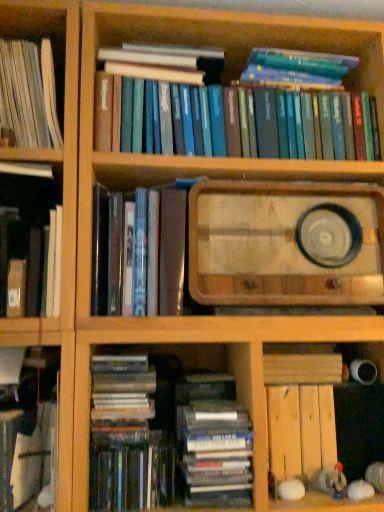
Question: Can you see white paper book at left, which is the eighth book from bottom to top, touching hardcover book at left, the 5th book from the bottom?

Choices:
 (A) yes
 (B) no

Answer: (B)

Question: From a real-world perspective, is white paper book at left, which ranks as the first book in top-to-bottom order, positioned over hardcover book at left, arranged as the 4th book when viewed from the top, based on gravity?

Choices:
 (A) yes
 (B) no

Answer: (A)

Question: From a real-world perspective, does white paper book at left, which is the eighth book from bottom to top, sit lower than hardcover book at left, arranged as the 4th book when viewed from the top?

Choices:
 (A) yes
 (B) no

Answer: (B)

Question: Is white paper book at left, which is the eighth book from bottom to top, completely or partially outside of hardcover book at left, the 5th book from the bottom?

Choices:
 (A) yes
 (B) no

Answer: (A)

Question: Can you confirm if white paper book at left, which ranks as the first book in top-to-bottom order, is shorter than hardcover book at left, arranged as the 4th book when viewed from the top?

Choices:
 (A) yes
 (B) no

Answer: (B)

Question: Is white paper book at left, which is the eighth book from bottom to top, to the left or to the right of wooden radio at center in the image?

Choices:
 (A) left
 (B) right

Answer: (A)

Question: Looking at the image, does white paper book at left, which is the eighth book from bottom to top, seem bigger or smaller compared to wooden radio at center?

Choices:
 (A) big
 (B) small

Answer: (B)

Question: From the image's perspective, is white paper book at left, which is the eighth book from bottom to top, located above or below wooden radio at center?

Choices:
 (A) above
 (B) below

Answer: (A)

Question: Is white paper book at left, which is the eighth book from bottom to top, in front of or behind wooden radio at center in the image?

Choices:
 (A) front
 (B) behind

Answer: (B)

Question: From their relative heights in the image, would you say hardcover books at upper center, positioned as the 2th book in top-to-bottom order, is taller or shorter than matte black book at center, arranged as the sixth book when ordered from the bottom?

Choices:
 (A) tall
 (B) short

Answer: (B)

Question: Is hardcover books at upper center, positioned as the 2th book in top-to-bottom order, spatially inside matte black book at center, the third book from the top, or outside of it?

Choices:
 (A) outside
 (B) inside

Answer: (A)

Question: From the image's perspective, relative to matte black book at center, the third book from the top, is hardcover books at upper center, positioned as the 2th book in top-to-bottom order, above or below?

Choices:
 (A) below
 (B) above

Answer: (B)

Question: Is hardcover books at upper center, placed as the 7th book when sorted from bottom to top, bigger or smaller than matte black book at center, arranged as the sixth book when ordered from the bottom?

Choices:
 (A) big
 (B) small

Answer: (A)

Question: Is hardcover books at lower center, which appears as the 5th book when viewed from the top, inside the boundaries of white paper book at left, which is the eighth book from bottom to top, or outside?

Choices:
 (A) inside
 (B) outside

Answer: (B)

Question: Is hardcover books at lower center, placed as the fourth book when sorted from bottom to top, taller or shorter than white paper book at left, which ranks as the first book in top-to-bottom order?

Choices:
 (A) short
 (B) tall

Answer: (A)